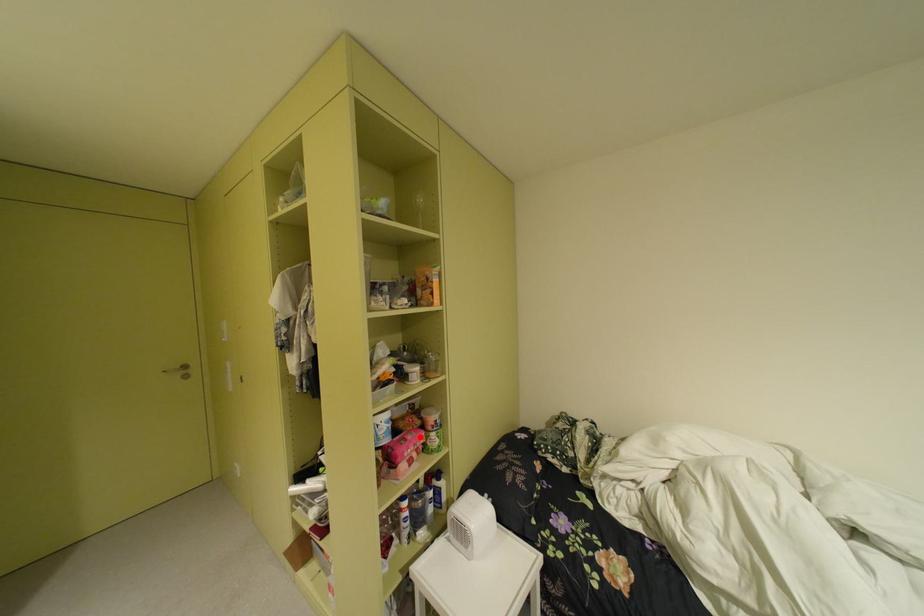
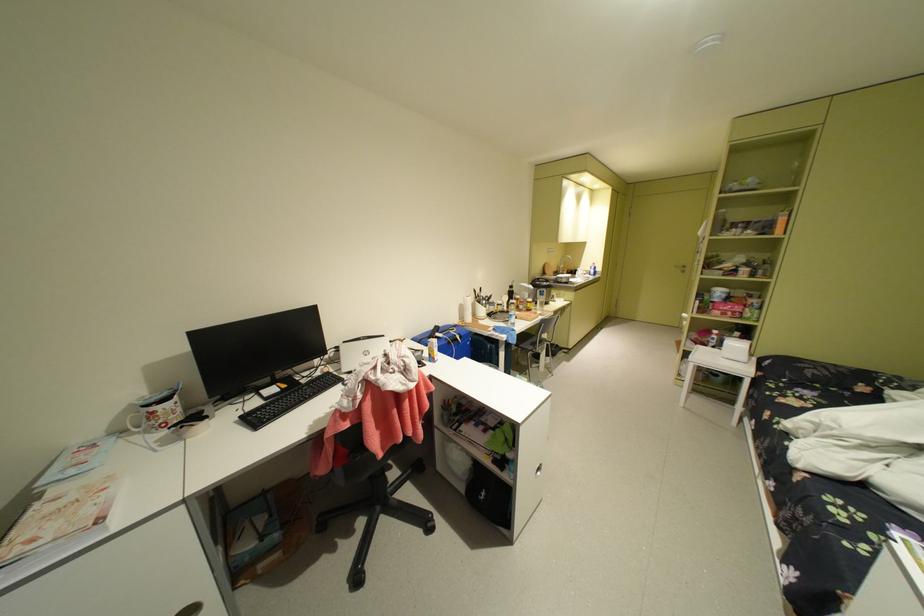
The point at the highlighted location is marked in the first image. Where is the corresponding point in the second image?

(740, 304)